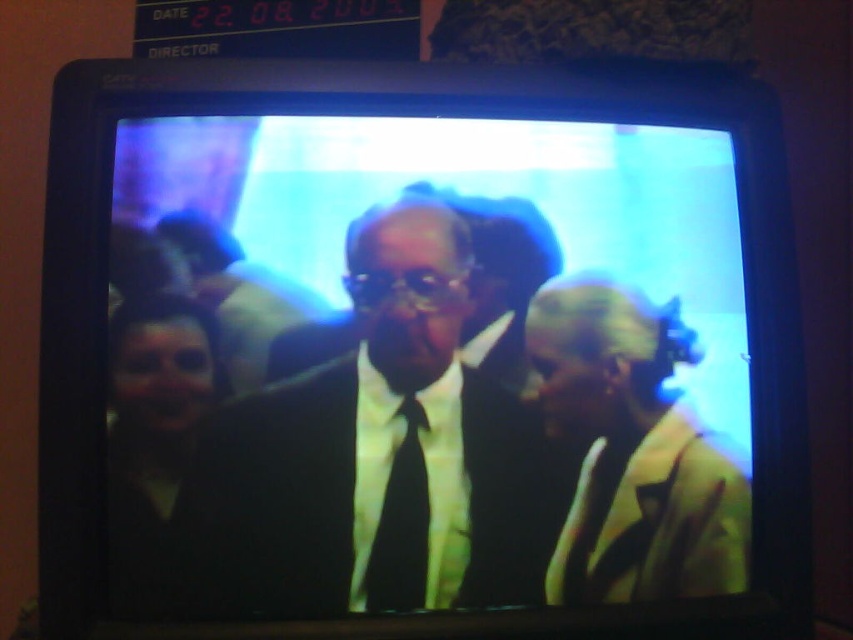
Who is more forward, (604,406) or (421,593)?

Point (421,593) is in front.

Is point (607, 408) more distant than point (399, 474)?

Yes, point (607, 408) is farther from viewer.

Between point (572, 332) and point (374, 598), which one is positioned in front?

Point (374, 598)

The width and height of the screenshot is (853, 640). Find the location of `matte yellow jacket at right`. matte yellow jacket at right is located at coordinates (633, 451).

You are a GUI agent. You are given a task and a screenshot of the screen. Output one action in this format:
    pyautogui.click(x=<x>, y=<y>)
    Task: Click on the black matte suit at center
    
    Given the screenshot: What is the action you would take?
    pyautogui.click(x=380, y=456)

Is black matte suit at center above matte yellow jacket at right?

Yes, black matte suit at center is above matte yellow jacket at right.

Identify the location of black matte suit at center. (380, 456).

Between black matte suit at center and black silk tie at center, which one appears on the right side from the viewer's perspective?

Positioned to the right is black matte suit at center.

Is point (322, 536) behind point (393, 464)?

That is False.

Image resolution: width=853 pixels, height=640 pixels. I want to click on black matte suit at center, so click(x=380, y=456).